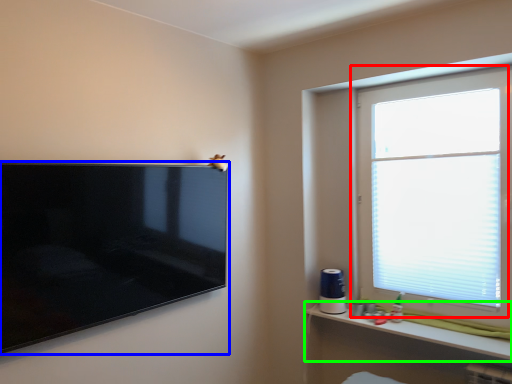
Question: Based on their relative distances, which object is nearer to window (highlighted by a red box)? Choose from television (highlighted by a blue box) and shelf (highlighted by a green box).

Choices:
 (A) television
 (B) shelf

Answer: (B)